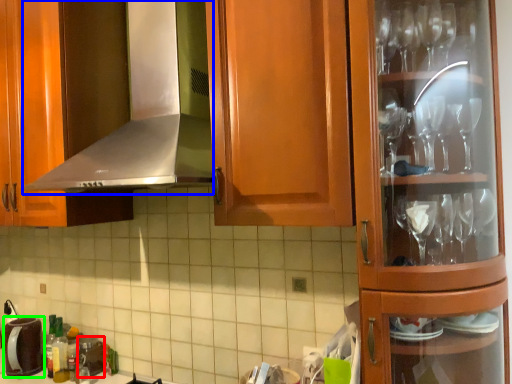
Question: Which object is positioned closest to appliance (highlighted by a red box)? Select from exhaust hood (highlighted by a blue box) and appliance (highlighted by a green box).

Choices:
 (A) exhaust hood
 (B) appliance

Answer: (B)